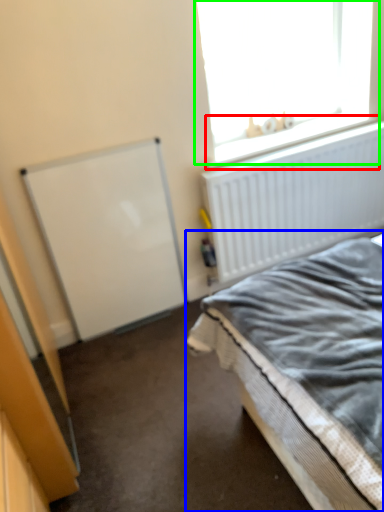
Question: Which is nearer to the window sill (highlighted by a red box)? bed (highlighted by a blue box) or window (highlighted by a green box).

Choices:
 (A) bed
 (B) window

Answer: (B)